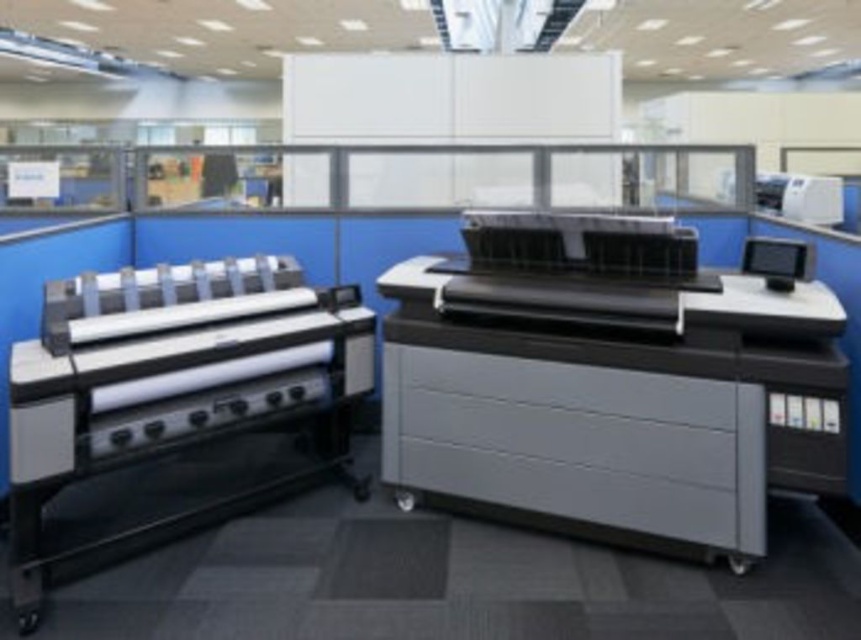
Is point (414, 477) positioned behind point (756, 188)?

No, (414, 477) is in front of (756, 188).

Who is taller, matte black printer at center or white plastic printer at upper right?

matte black printer at center is taller.

Find the location of a particular element. The width and height of the screenshot is (861, 640). matte black printer at center is located at coordinates (614, 401).

Identify the location of matte black printer at center. The width and height of the screenshot is (861, 640). (614, 401).

Is matte black printer at center to the left of black glossy monitor at upper right from the viewer's perspective?

Yes, matte black printer at center is to the left of black glossy monitor at upper right.

Who is more distant from viewer, (784, 346) or (810, 257)?

Point (810, 257)

You are a GUI agent. You are given a task and a screenshot of the screen. Output one action in this format:
    pyautogui.click(x=<x>, y=<y>)
    Task: Click on the matte black printer at center
    This screenshot has height=640, width=861.
    Given the screenshot: What is the action you would take?
    614,401

Is matte black printer at center above matte black printer at left?

Yes.

Does matte black printer at center appear on the right side of matte black printer at left?

Correct, you'll find matte black printer at center to the right of matte black printer at left.

Measure the distance between matte black printer at center and camera.

The distance of matte black printer at center from camera is 2.97 meters.

The image size is (861, 640). I want to click on matte black printer at center, so click(614, 401).